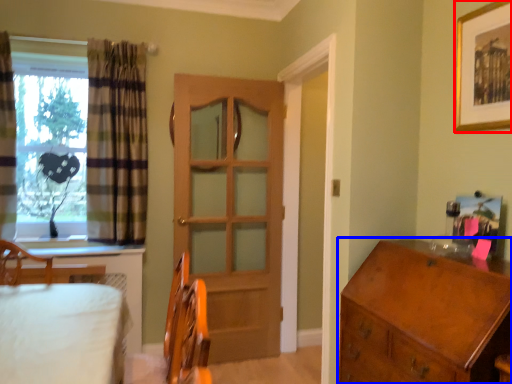
Question: Which point is closer to the camera, picture frame (highlighted by a red box) or chest of drawers (highlighted by a blue box)?

Choices:
 (A) picture frame
 (B) chest of drawers

Answer: (B)